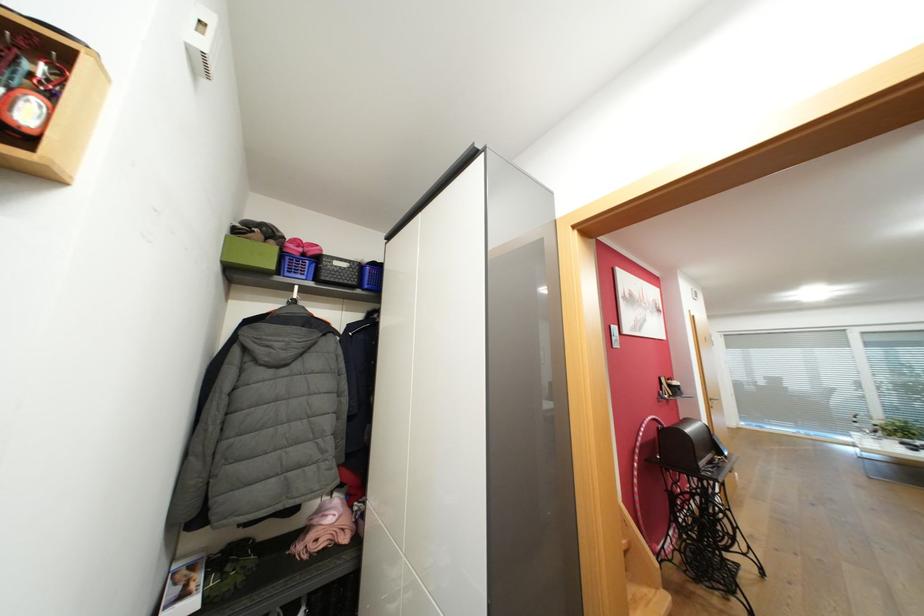
The image size is (924, 616). I want to click on black woven basket, so click(661, 219).